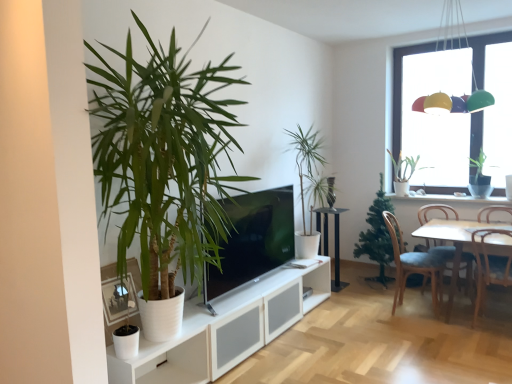
This screenshot has height=384, width=512. Find the location of `free space in front of black metal table at center, which is the first table in left-to-right order`. free space in front of black metal table at center, which is the first table in left-to-right order is located at coordinates (346, 294).